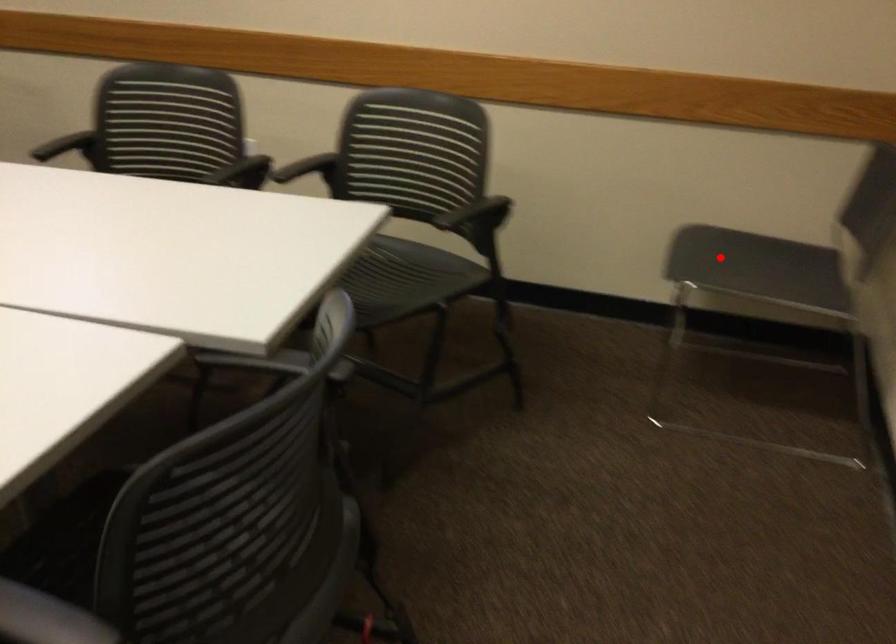
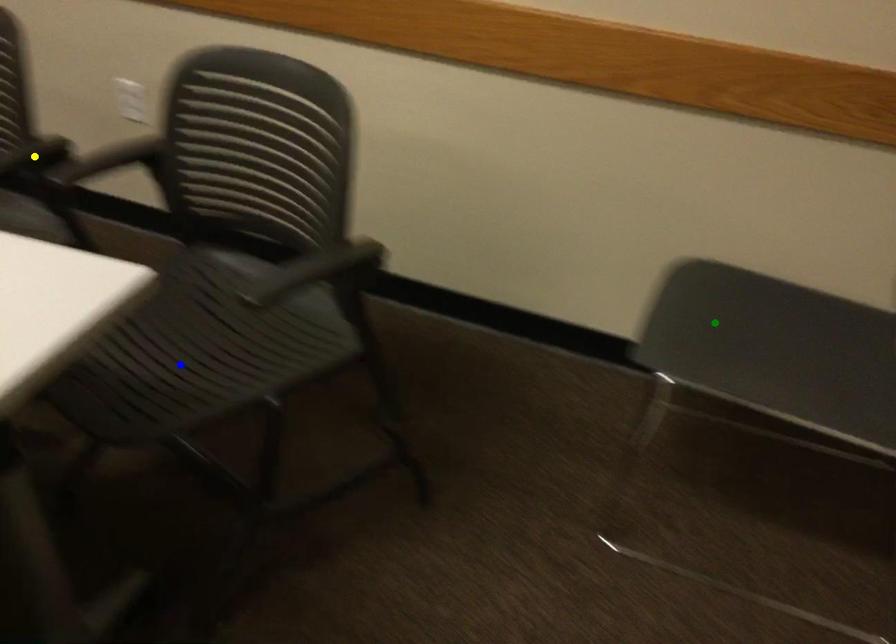
Question: I am providing you with two images of the same scene from different viewpoints. A red point is marked on the first image. You are given multiple points on the second image. Can you choose the point in image 2 that corresponds to the point in image 1?

Choices:
 (A) yellow point
 (B) blue point
 (C) green point

Answer: (C)